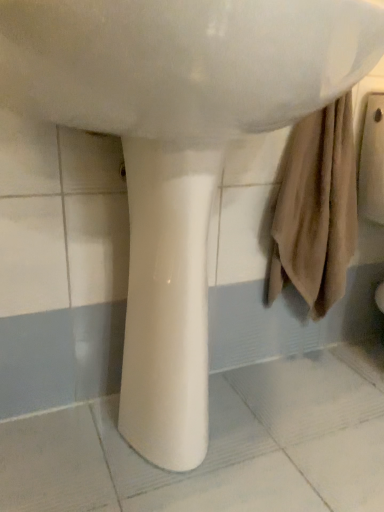
You are a GUI agent. You are given a task and a screenshot of the screen. Output one action in this format:
    pyautogui.click(x=<x>, y=<y>)
    Task: Click on the vacant space underneath white glossy sink at center (from a real-world perspective)
    Image resolution: width=384 pixels, height=512 pixels.
    Given the screenshot: What is the action you would take?
    pyautogui.click(x=203, y=452)